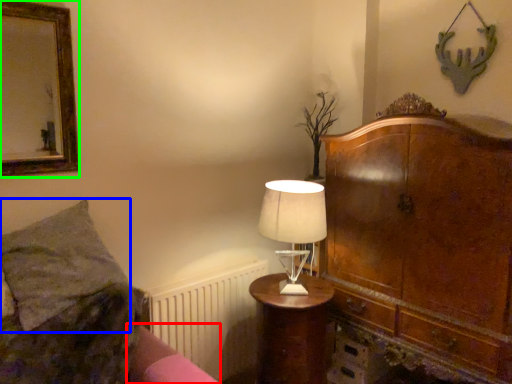
Question: Based on their relative distances, which object is nearer to bed frame (highlighted by a red box)? Choose from pillow (highlighted by a blue box) and picture frame (highlighted by a green box).

Choices:
 (A) pillow
 (B) picture frame

Answer: (A)